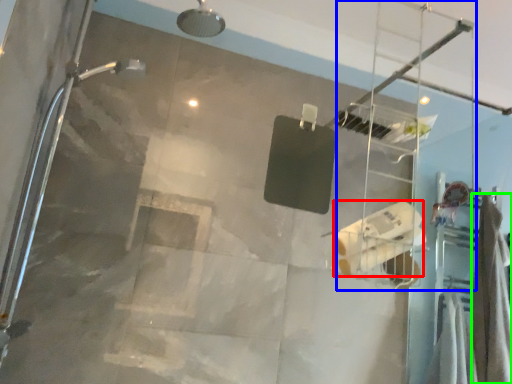
Question: Which object is the farthest from toilet paper (highlighted by a red box)? Choose among these: ladder (highlighted by a blue box) or shower curtain (highlighted by a green box).

Choices:
 (A) ladder
 (B) shower curtain

Answer: (A)